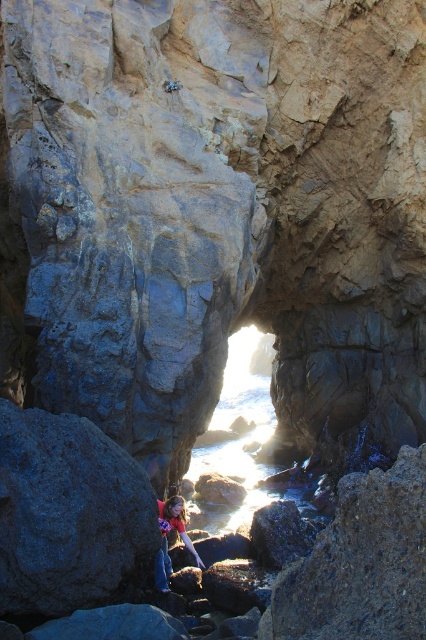
Question: Considering the relative positions of translucent water at center and matte red shirt at lower center in the image provided, where is translucent water at center located with respect to matte red shirt at lower center?

Choices:
 (A) left
 (B) right

Answer: (B)

Question: Which of the following is the farthest from the observer?

Choices:
 (A) (160, 573)
 (B) (238, 440)

Answer: (B)

Question: In this image, where is translucent water at center located relative to matte red shirt at lower center?

Choices:
 (A) left
 (B) right

Answer: (B)

Question: Is translucent water at center further to camera compared to matte red shirt at lower center?

Choices:
 (A) no
 (B) yes

Answer: (B)

Question: Which object appears farthest from the camera in this image?

Choices:
 (A) matte red shirt at lower center
 (B) translucent water at center

Answer: (B)